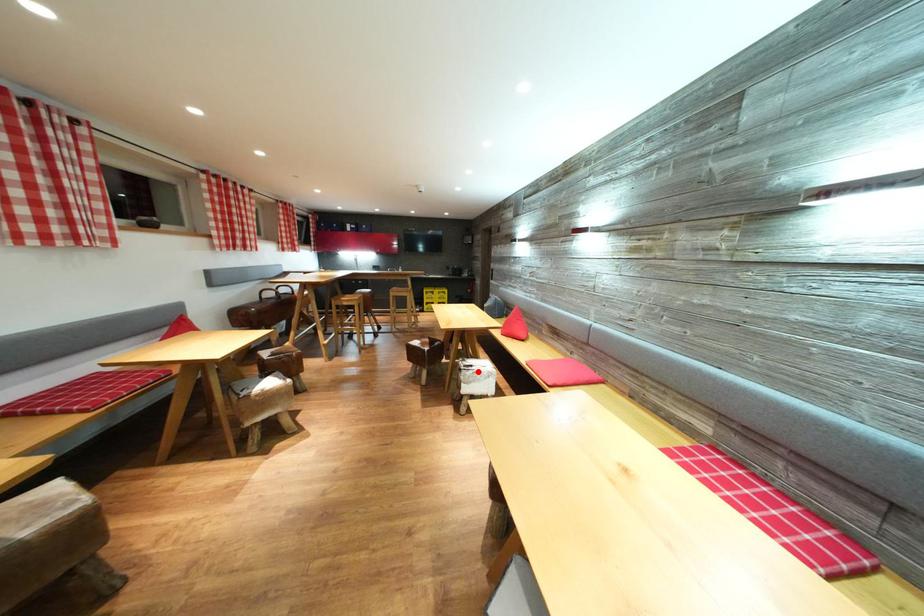
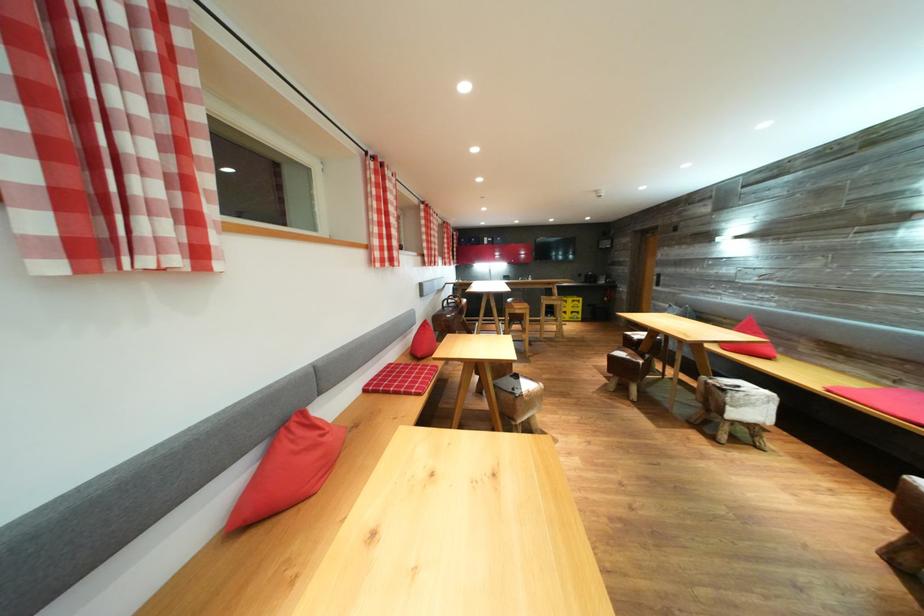
Question: I am providing you with two images of the same scene from different viewpoints. In image1, a red point is highlighted. Considering the same 3D point in image2, which of the following is correct?

Choices:
 (A) It is closer
 (B) It is farther

Answer: (B)